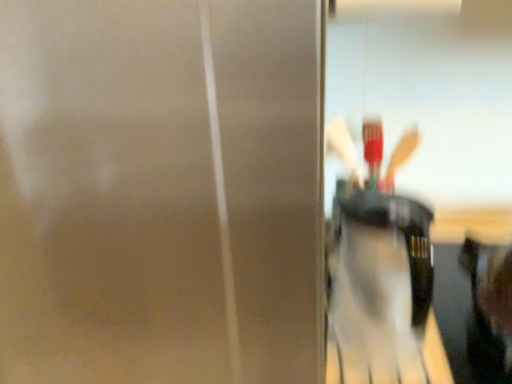
Question: Considering the relative positions of matte silver screen door at center and translucent plastic cup at center in the image provided, is matte silver screen door at center to the right of translucent plastic cup at center from the viewer's perspective?

Choices:
 (A) no
 (B) yes

Answer: (A)

Question: From the image's perspective, is matte silver screen door at center located beneath translucent plastic cup at center?

Choices:
 (A) yes
 (B) no

Answer: (A)

Question: Is matte silver screen door at center far away from translucent plastic cup at center?

Choices:
 (A) no
 (B) yes

Answer: (A)

Question: From a real-world perspective, is matte silver screen door at center positioned over translucent plastic cup at center based on gravity?

Choices:
 (A) yes
 (B) no

Answer: (B)

Question: Is the depth of matte silver screen door at center greater than that of translucent plastic cup at center?

Choices:
 (A) yes
 (B) no

Answer: (B)

Question: In terms of width, does translucent plastic cup at center look wider or thinner when compared to smooth black hair at right?

Choices:
 (A) thin
 (B) wide

Answer: (A)

Question: From the image's perspective, is translucent plastic cup at center above or below smooth black hair at right?

Choices:
 (A) above
 (B) below

Answer: (B)

Question: Is translucent plastic cup at center to the left or to the right of smooth black hair at right in the image?

Choices:
 (A) right
 (B) left

Answer: (B)

Question: In terms of height, does translucent plastic cup at center look taller or shorter compared to smooth black hair at right?

Choices:
 (A) short
 (B) tall

Answer: (A)

Question: Would you say smooth black hair at right is inside or outside matte silver screen door at center?

Choices:
 (A) inside
 (B) outside

Answer: (B)

Question: Considering the positions of smooth black hair at right and matte silver screen door at center in the image, is smooth black hair at right taller or shorter than matte silver screen door at center?

Choices:
 (A) short
 (B) tall

Answer: (A)

Question: Considering the relative positions of smooth black hair at right and matte silver screen door at center in the image provided, is smooth black hair at right to the left or to the right of matte silver screen door at center?

Choices:
 (A) left
 (B) right

Answer: (B)

Question: Looking at their shapes, would you say smooth black hair at right is wider or thinner than matte silver screen door at center?

Choices:
 (A) thin
 (B) wide

Answer: (A)

Question: Looking at the image, does smooth black hair at right seem bigger or smaller compared to translucent plastic cup at center?

Choices:
 (A) small
 (B) big

Answer: (B)

Question: From the image's perspective, relative to translucent plastic cup at center, is smooth black hair at right above or below?

Choices:
 (A) below
 (B) above

Answer: (B)